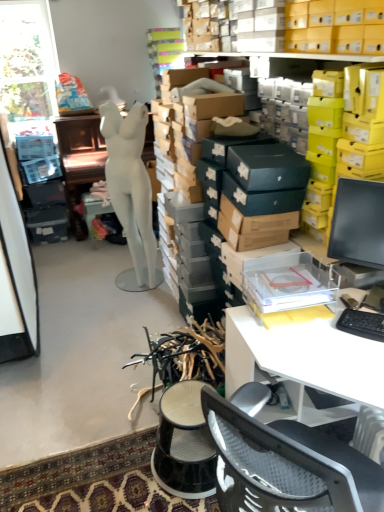
Question: Is point (41, 99) closer or farther from the camera than point (180, 487)?

Choices:
 (A) farther
 (B) closer

Answer: (A)

Question: Based on their sizes in the image, would you say transparent glass window at upper left is bigger or smaller than black plastic stool at center?

Choices:
 (A) big
 (B) small

Answer: (A)

Question: Considering the real-world distances, which object is farthest from the black plastic keyboard at right?

Choices:
 (A) black plastic stool at center
 (B) white plastic desk at lower right
 (C) white matte mannequin at center
 (D) white matte mannequin at center
 (E) yellow cardboard boxes at upper right

Answer: (D)

Question: Estimate the real-world distances between objects in this image. Which object is closer to the black plastic stool at center?

Choices:
 (A) white plastic desk at lower right
 (B) black plastic keyboard at right
 (C) white matte mannequin at center
 (D) transparent glass window at upper left
 (E) yellow cardboard boxes at upper right

Answer: (A)